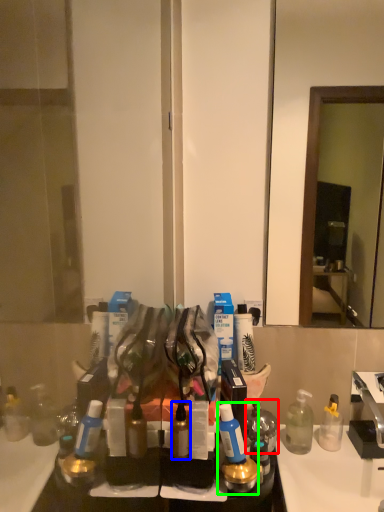
Question: Considering the real-world distances, which object is closest to toiletry (highlighted by a red box)? toiletry (highlighted by a blue box) or toiletry (highlighted by a green box).

Choices:
 (A) toiletry
 (B) toiletry

Answer: (B)